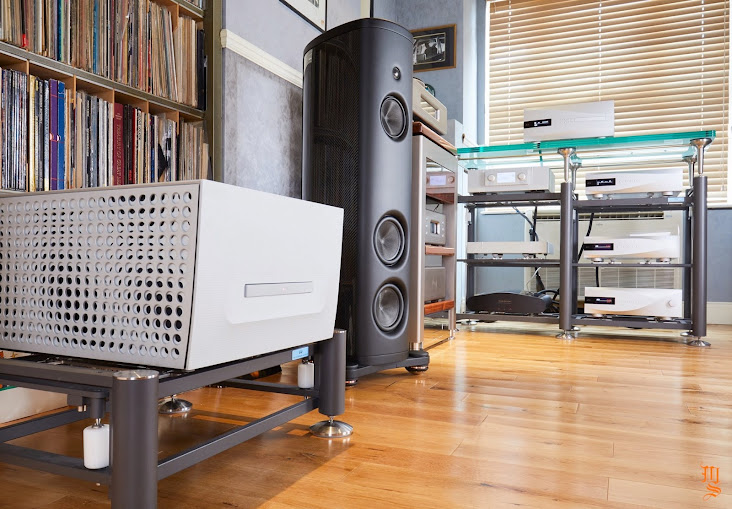
Find the location of `wood floor`. wood floor is located at coordinates (424, 474).